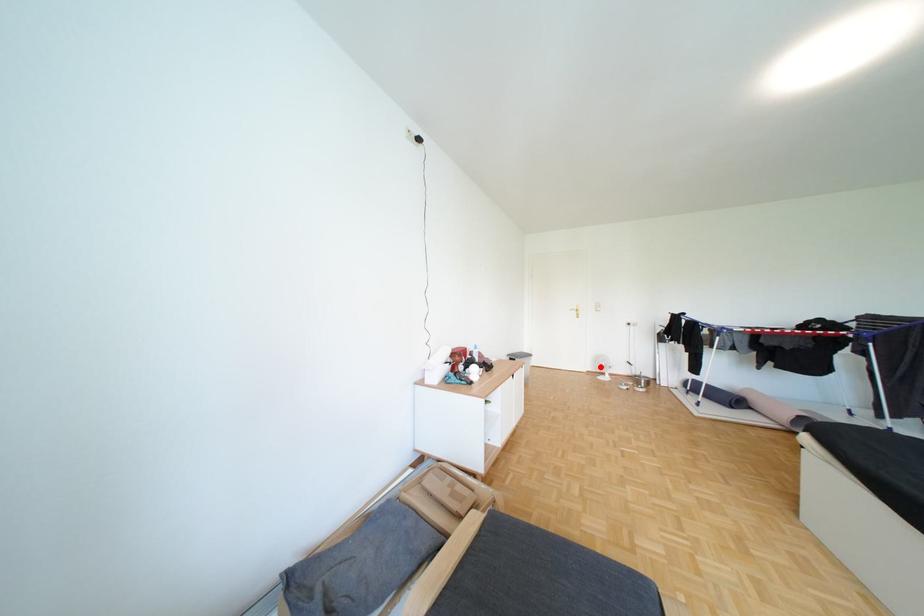
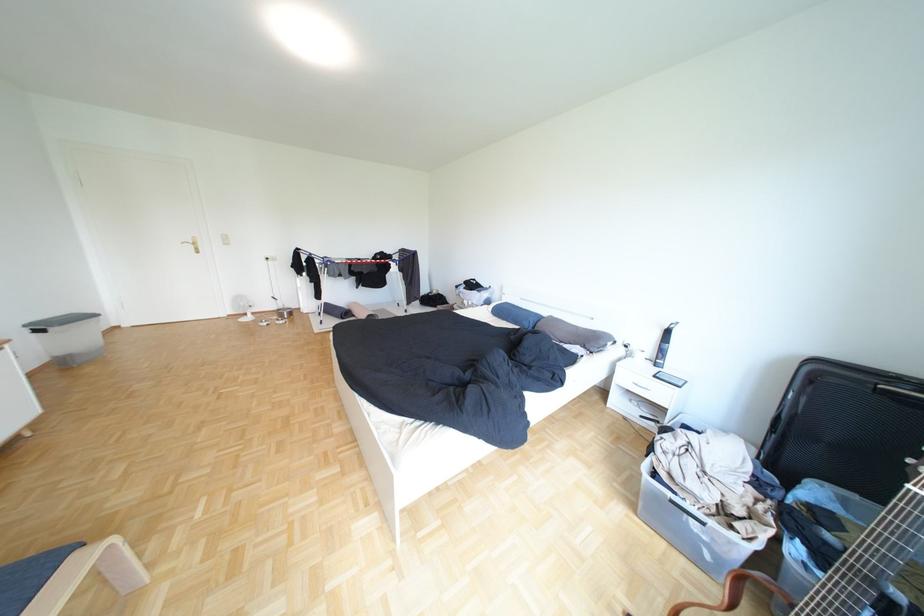
Where in the second image is the point corresponding to the highlighted location from the first image?

(238, 310)